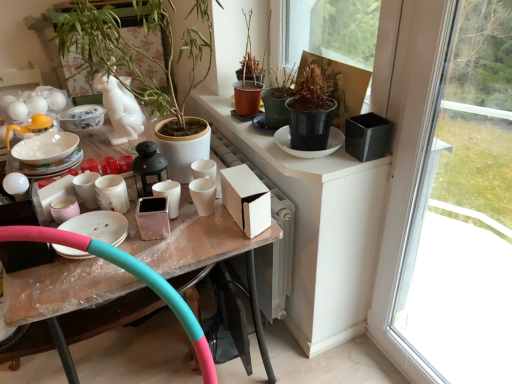
Find the location of a particular element. This screenshot has width=512, height=384. free spot above matte pink plate at lower left, the third tableware viewed from the right (from a real-world perspective) is located at coordinates (95, 226).